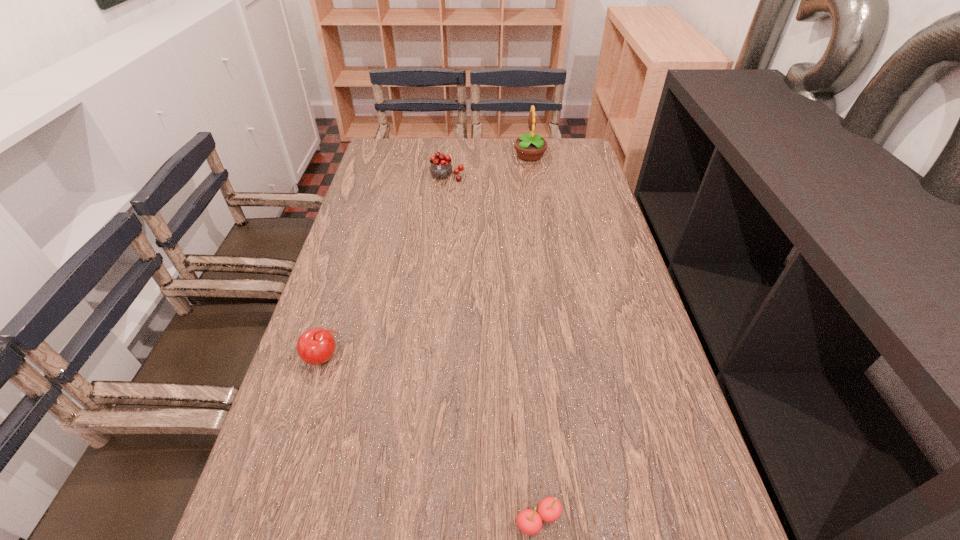
This screenshot has width=960, height=540. Identify the location of the tallest object. (530, 147).

Locate an element on the screen. Image resolution: width=960 pixels, height=540 pixels. sunflower is located at coordinates (530, 147).

This screenshot has width=960, height=540. What are the coordinates of `the third object from right to left` in the screenshot? It's located at [x=440, y=168].

Where is `the farthest cherry`? the farthest cherry is located at coordinates (440, 168).

You are a GUI agent. You are given a task and a screenshot of the screen. Output one action in this format:
    pyautogui.click(x=<x>, y=<y>)
    Task: Click on the second nearest cherry
    This screenshot has height=540, width=960.
    Given the screenshot: What is the action you would take?
    pyautogui.click(x=316, y=346)

At what (x,y) coordinates should I click in order to perform the action: click on the leftmost object. Please return your answer as a coordinate pair (x, y). This screenshot has width=960, height=540. Looking at the image, I should click on (316, 346).

The image size is (960, 540). What are the coordinates of `the nearest object` in the screenshot? It's located at (529, 521).

Locate an element on the screen. Image resolution: width=960 pixels, height=540 pixels. the nearest cherry is located at coordinates (529, 521).

Locate an element on the screen. vacant space situated on the face of the tallest object is located at coordinates (476, 156).

Image resolution: width=960 pixels, height=540 pixels. Find the location of `vacant space located on the face of the tallest object`. vacant space located on the face of the tallest object is located at coordinates (422, 156).